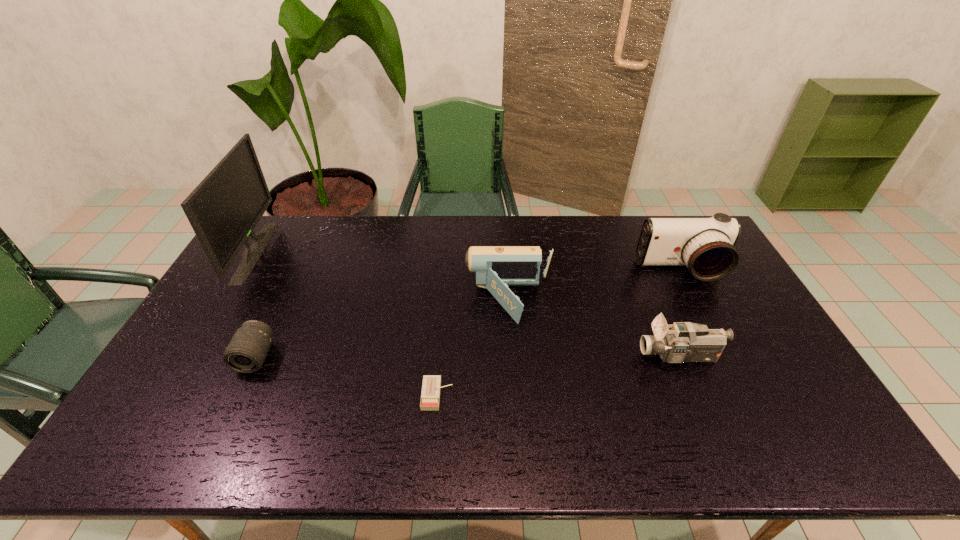
Identify the location of object that is at the left edge. (223, 210).

The height and width of the screenshot is (540, 960). Identify the location of object that is at the right edge. (705, 245).

Locate an element on the screen. The image size is (960, 540). object located at the far left corner is located at coordinates (223, 210).

In the image, there is a desktop. Where is `vacant space at the far edge`? This screenshot has height=540, width=960. vacant space at the far edge is located at coordinates (407, 252).

This screenshot has width=960, height=540. In the image, there is a desktop. In order to click on free space at the left edge in this screenshot , I will do `click(199, 413)`.

The height and width of the screenshot is (540, 960). In the image, there is a desktop. In order to click on vacant space at the right edge in this screenshot , I will do 777,357.

At what (x,y) coordinates should I click in order to perform the action: click on free space at the far left corner of the desktop. Please return your answer as a coordinate pair (x, y). Looking at the image, I should click on (269, 222).

The image size is (960, 540). In order to click on empty space that is in between the leftmost object and the shortest object in this screenshot , I will do (347, 323).

At what (x,y) coordinates should I click in order to perform the action: click on vacant space that's between the nearest camcorder and the monitor. Please return your answer as a coordinate pair (x, y). Looking at the image, I should click on (468, 304).

Find the location of a particular element. The height and width of the screenshot is (540, 960). unoccupied position between the second tallest object and the fifth object from right to left is located at coordinates 468,314.